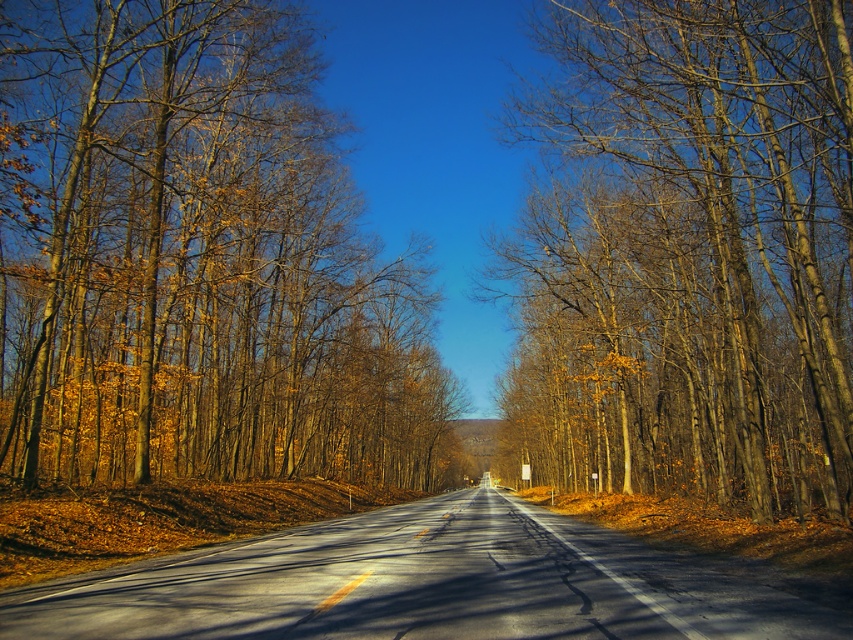
Question: Among these points, which one is farthest from the camera?

Choices:
 (A) (144, 35)
 (B) (758, 403)

Answer: (A)

Question: Does brown bark tree at center appear on the right side of brown wood tree at center?

Choices:
 (A) yes
 (B) no

Answer: (B)

Question: Which of the following is the closest to the observer?

Choices:
 (A) brown wood tree at center
 (B) brown bark tree at center

Answer: (A)

Question: Is brown bark tree at center above brown wood tree at center?

Choices:
 (A) yes
 (B) no

Answer: (A)

Question: Can you confirm if brown bark tree at center is positioned above brown wood tree at center?

Choices:
 (A) yes
 (B) no

Answer: (A)